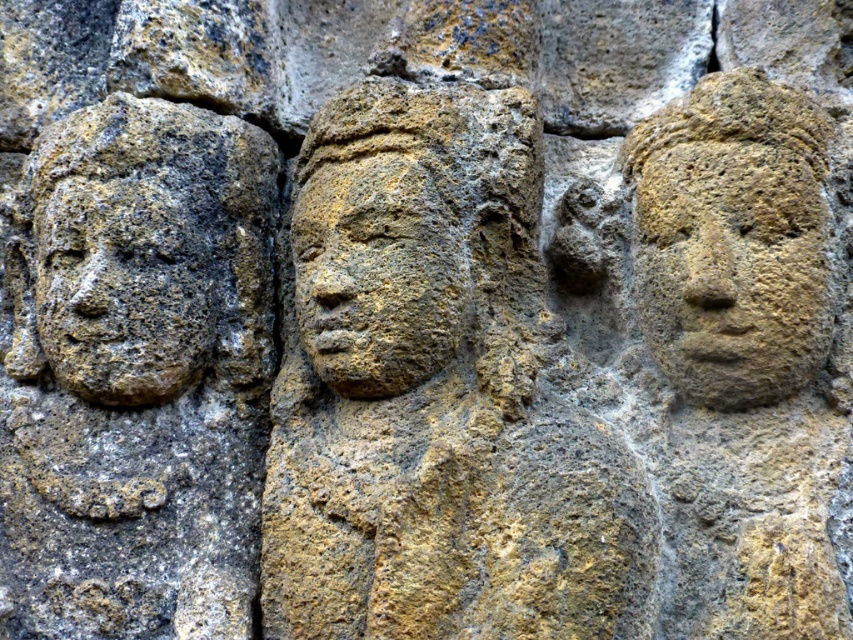
Question: Does earthy stone carving at left appear over rough stone face at right?

Choices:
 (A) no
 (B) yes

Answer: (A)

Question: Estimate the real-world distances between objects in this image. Which object is farther from the yellow stone face at center?

Choices:
 (A) earthy stone carving at left
 (B) rough stone face at right

Answer: (B)

Question: Among these points, which one is farthest from the camera?

Choices:
 (A) (599, 577)
 (B) (227, 164)

Answer: (B)

Question: Does earthy stone carving at center have a larger size compared to rough stone face at right?

Choices:
 (A) yes
 (B) no

Answer: (A)

Question: Does earthy stone carving at left appear on the right side of rough stone face at right?

Choices:
 (A) no
 (B) yes

Answer: (A)

Question: Which of the following is the closest to the observer?

Choices:
 (A) (198, 195)
 (B) (506, 244)

Answer: (B)